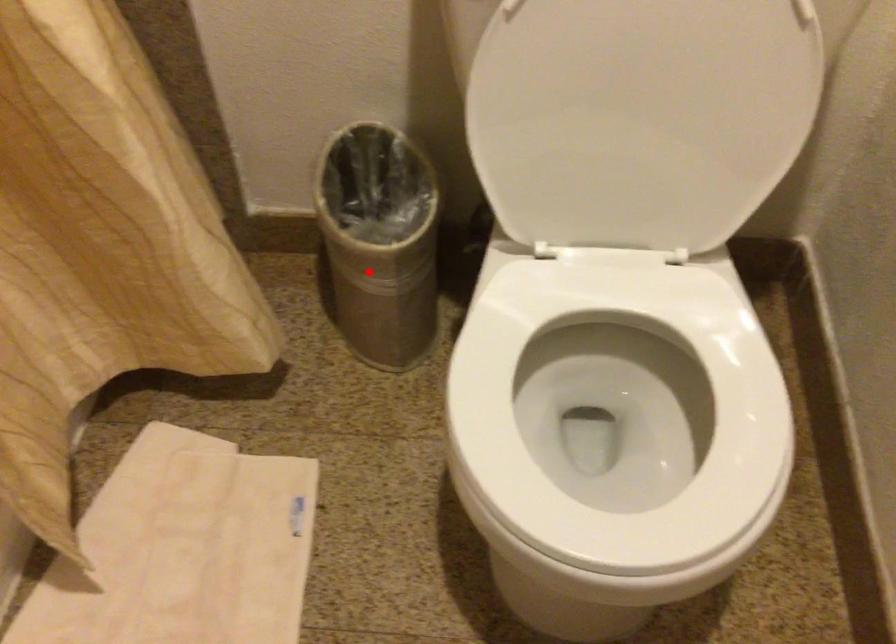
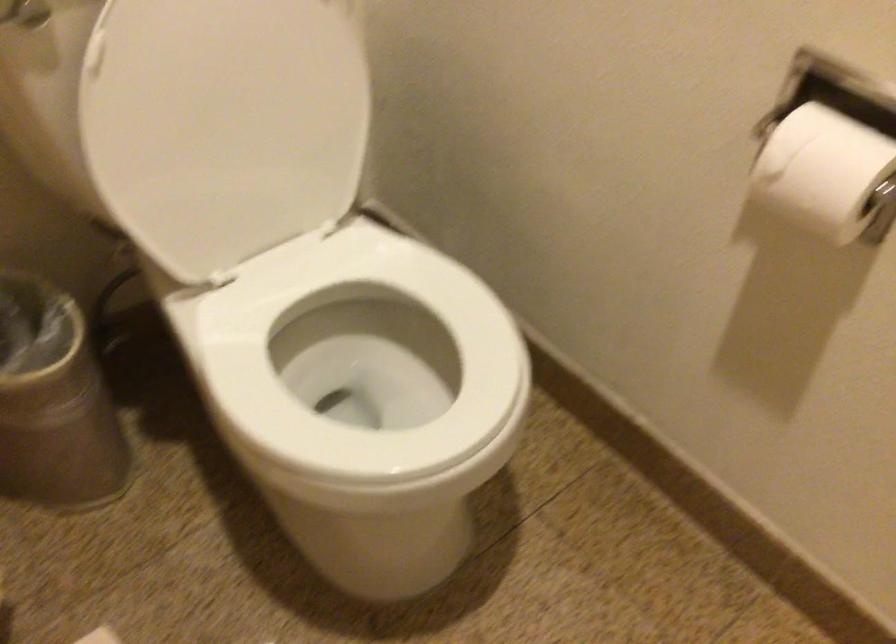
Locate, in the second image, the point that corresponds to the highlighted location in the first image.

(54, 402)